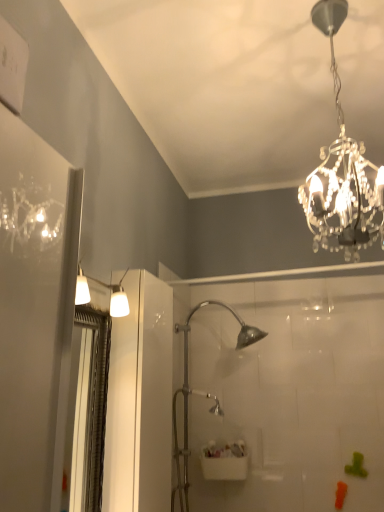
Identify the location of clear plastic screen door at left. (90, 411).

The image size is (384, 512). In order to click on clear crystal chandelier at upper right in this screenshot , I will do `click(342, 172)`.

This screenshot has height=512, width=384. What are the coordinates of `white plastic sink at center` in the screenshot? It's located at (224, 461).

Is white plastic sink at center bigger than clear plastic screen door at left?

No, white plastic sink at center is not bigger than clear plastic screen door at left.

Would you consider white plastic sink at center to be distant from clear plastic screen door at left?

Yes, white plastic sink at center is far from clear plastic screen door at left.

Considering the relative positions of white plastic sink at center and clear plastic screen door at left in the image provided, is white plastic sink at center to the left of clear plastic screen door at left from the viewer's perspective?

Incorrect, white plastic sink at center is not on the left side of clear plastic screen door at left.

Is white plastic sink at center taller than clear plastic screen door at left?

No.

Is clear plastic screen door at left wider than white plastic sink at center?

No.

Is clear plastic screen door at left surrounding white plastic sink at center?

Actually, white plastic sink at center is outside clear plastic screen door at left.

From a real-world perspective, is clear plastic screen door at left positioned under white plastic sink at center based on gravity?

Actually, clear plastic screen door at left is physically above white plastic sink at center in the real world.

Which is more to the left, clear crystal chandelier at upper right or white plastic sink at center?

Positioned to the left is white plastic sink at center.

Consider the image. Does clear crystal chandelier at upper right turn towards white plastic sink at center?

No, clear crystal chandelier at upper right does not turn towards white plastic sink at center.

Which of these two, clear crystal chandelier at upper right or white plastic sink at center, stands shorter?

Standing shorter between the two is white plastic sink at center.

Locate an element on the screen. sink that appears on the left of clear crystal chandelier at upper right is located at coordinates (224, 461).

Which is correct: clear plastic screen door at left is inside clear crystal chandelier at upper right, or outside of it?

The correct answer is: outside.

Considering the sizes of objects clear plastic screen door at left and clear crystal chandelier at upper right in the image provided, who is shorter, clear plastic screen door at left or clear crystal chandelier at upper right?

clear plastic screen door at left is shorter.

Is clear crystal chandelier at upper right wider or thinner than clear plastic screen door at left?

clear crystal chandelier at upper right is wider than clear plastic screen door at left.

Considering the sizes of objects clear crystal chandelier at upper right and clear plastic screen door at left in the image provided, who is taller, clear crystal chandelier at upper right or clear plastic screen door at left?

Standing taller between the two is clear crystal chandelier at upper right.

Where is `screen door below the clear crystal chandelier at upper right (from a real-world perspective)`? The width and height of the screenshot is (384, 512). screen door below the clear crystal chandelier at upper right (from a real-world perspective) is located at coordinates (90, 411).

Which object is further away from the camera taking this photo, clear crystal chandelier at upper right or clear plastic screen door at left?

clear plastic screen door at left is behind.

From the image's perspective, is white plastic sink at center above or below clear crystal chandelier at upper right?

white plastic sink at center is below clear crystal chandelier at upper right.

In the image, is white plastic sink at center on the left side or the right side of clear crystal chandelier at upper right?

Based on their positions, white plastic sink at center is located to the left of clear crystal chandelier at upper right.

From the picture: Is white plastic sink at center positioned beyond the bounds of clear crystal chandelier at upper right?

Yes, white plastic sink at center is not within clear crystal chandelier at upper right.

Does white plastic sink at center touch clear crystal chandelier at upper right?

No.

Find the location of a particular element. screen door that appears above the white plastic sink at center (from the image's perspective) is located at coordinates (90, 411).

Find the location of a particular element. The image size is (384, 512). sink on the right side of clear plastic screen door at left is located at coordinates (224, 461).

Which object lies further to the anchor point white plastic sink at center, clear crystal chandelier at upper right or clear plastic screen door at left?

Among the two, clear crystal chandelier at upper right is located further to white plastic sink at center.

Based on their spatial positions, is white plastic sink at center or clear crystal chandelier at upper right further from clear plastic screen door at left?

white plastic sink at center.

Looking at the image, which one is located further to clear crystal chandelier at upper right, clear plastic screen door at left or white plastic sink at center?

white plastic sink at center lies further to clear crystal chandelier at upper right than the other object.

From the image, which object appears to be farther from clear crystal chandelier at upper right, white plastic sink at center or clear plastic screen door at left?

white plastic sink at center is further to clear crystal chandelier at upper right.

From the image, which object appears to be farther from white plastic sink at center, clear plastic screen door at left or clear crystal chandelier at upper right?

Among the two, clear crystal chandelier at upper right is located further to white plastic sink at center.

Looking at the image, which one is located further to clear plastic screen door at left, clear crystal chandelier at upper right or white plastic sink at center?

white plastic sink at center.

Image resolution: width=384 pixels, height=512 pixels. Identify the location of screen door between clear crystal chandelier at upper right and white plastic sink at center from top to bottom. 90,411.